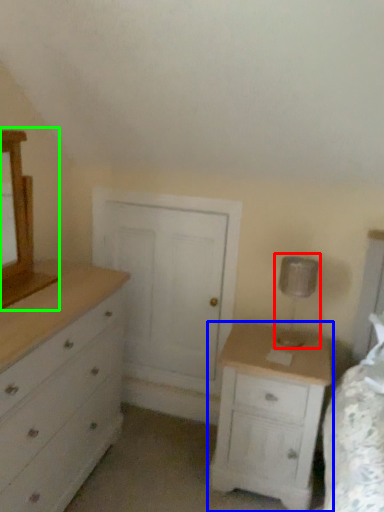
Question: Considering the real-world distances, which object is closest to table lamp (highlighted by a red box)? nightstand (highlighted by a blue box) or medicine cabinet (highlighted by a green box).

Choices:
 (A) nightstand
 (B) medicine cabinet

Answer: (A)